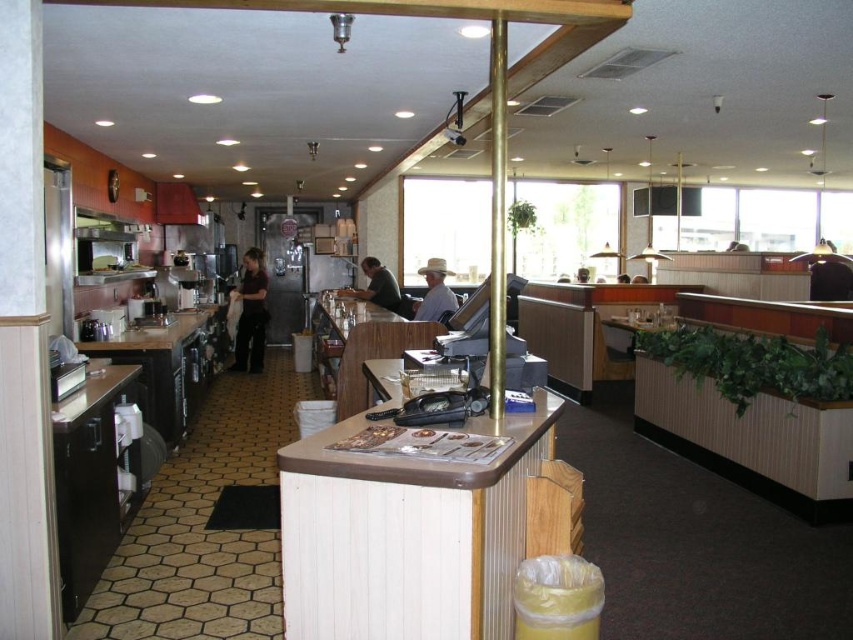
Who is more forward, (262, 330) or (440, 301)?

Point (440, 301) is more forward.

Looking at this image, is dark brown fabric apron at center closer to camera compared to matte brown cowboy hat at center?

No, it is behind matte brown cowboy hat at center.

At what (x,y) coordinates should I click in order to perform the action: click on dark brown fabric apron at center. Please return your answer as a coordinate pair (x, y). Looking at the image, I should click on (251, 314).

Is matte brown cowboy hat at center to the left of smooth brown leather jacket at center from the viewer's perspective?

Correct, you'll find matte brown cowboy hat at center to the left of smooth brown leather jacket at center.

Is point (445, 312) farther from viewer compared to point (579, 275)?

No.

The width and height of the screenshot is (853, 640). Find the location of `matte brown cowboy hat at center`. matte brown cowboy hat at center is located at coordinates (434, 292).

Where is `dark brown fabric apron at center`? The image size is (853, 640). dark brown fabric apron at center is located at coordinates (251, 314).

Does dark brown fabric apron at center have a greater height compared to smooth brown leather jacket at center?

Yes, dark brown fabric apron at center is taller than smooth brown leather jacket at center.

Between point (239, 340) and point (585, 276), which one is positioned in front?

Point (239, 340)

This screenshot has height=640, width=853. I want to click on dark brown fabric apron at center, so click(251, 314).